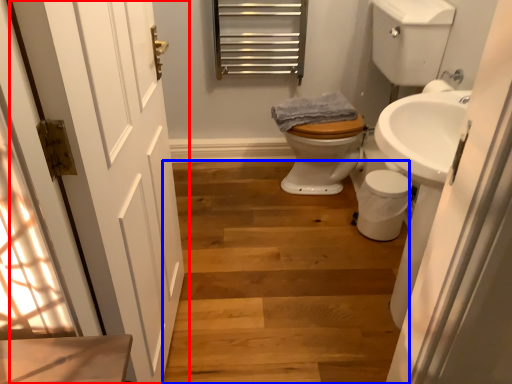
Question: Among these objects, which one is farthest to the camera, door (highlighted by a red box) or stairs (highlighted by a blue box)?

Choices:
 (A) door
 (B) stairs

Answer: (B)